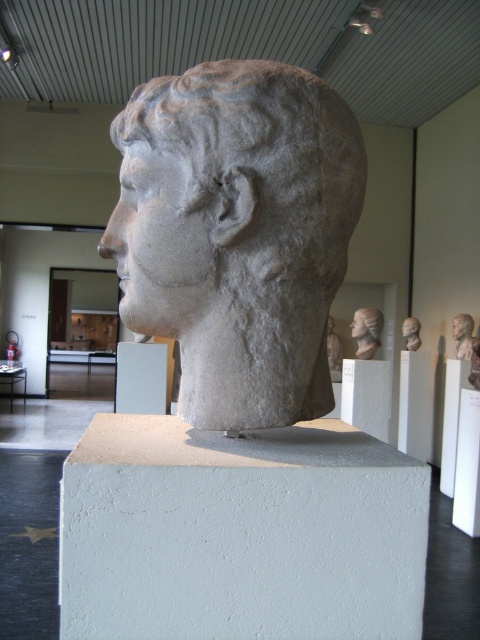
Does white matte pillar at center appear under white stone head at center?

Yes.

Which is above, white matte pillar at center or white stone head at center?

Positioned higher is white stone head at center.

At what (x,y) coordinates should I click in order to perform the action: click on white matte pillar at center. Please return your answer as a coordinate pair (x, y). This screenshot has width=480, height=640. Looking at the image, I should click on (367, 396).

Identify the location of white matte pillar at center. (367, 396).

Does white concrete block at center appear on the left side of gray stone head at center?

Yes, white concrete block at center is to the left of gray stone head at center.

Is white concrete block at center above gray stone head at center?

No, white concrete block at center is not above gray stone head at center.

Where is `white concrete block at center`? white concrete block at center is located at coordinates (141, 378).

At what (x,y) coordinates should I click in order to perform the action: click on white concrete block at center. Please return your answer as a coordinate pair (x, y). Looking at the image, I should click on (141, 378).

Can you confirm if gray stone bust at center is bigger than white concrete block at center?

Incorrect, gray stone bust at center is not larger than white concrete block at center.

Between gray stone bust at center and white concrete block at center, which one is positioned lower?

white concrete block at center is below.

You are a GUI agent. You are given a task and a screenshot of the screen. Output one action in this format:
    pyautogui.click(x=<x>, y=<y>)
    Task: Click on the gray stone bust at center
    The image size is (480, 640).
    Given the screenshot: What is the action you would take?
    pyautogui.click(x=238, y=234)